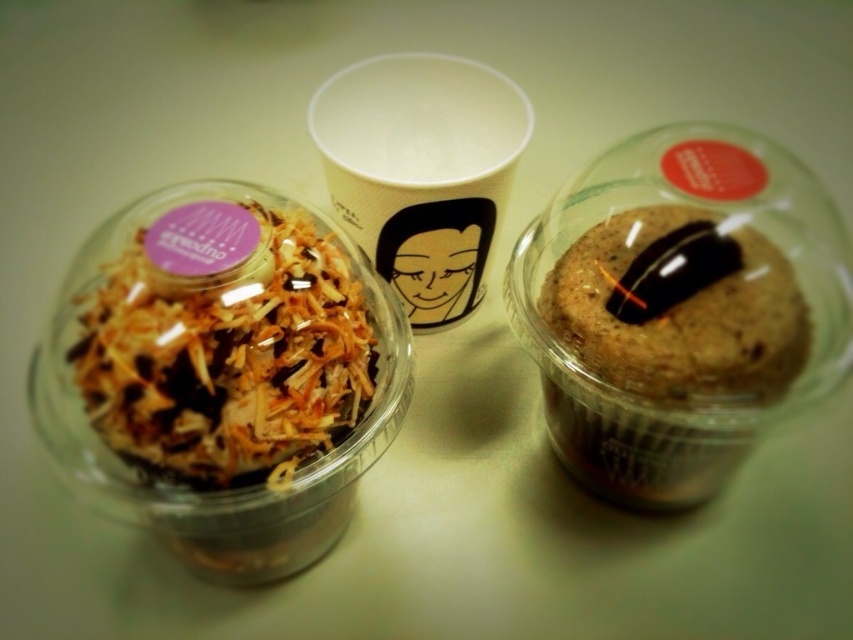
Question: Observing the image, what is the correct spatial positioning of brown matte muffin at right in reference to white paper cup at center?

Choices:
 (A) below
 (B) above

Answer: (A)

Question: Which object is farther from the camera taking this photo?

Choices:
 (A) translucent plastic dessert at left
 (B) brown matte muffin at right
 (C) white paper cup at center

Answer: (C)

Question: Which of the following is the farthest from the observer?

Choices:
 (A) white paper cup at center
 (B) translucent plastic dessert at left
 (C) brown matte muffin at right

Answer: (A)

Question: Among these points, which one is farthest from the camera?

Choices:
 (A) (521, 108)
 (B) (113, 262)
 (C) (599, 346)

Answer: (A)

Question: Is translucent plastic dessert at left closer to camera compared to brown matte muffin at right?

Choices:
 (A) yes
 (B) no

Answer: (A)

Question: Is translucent plastic dessert at left thinner than brown matte muffin at right?

Choices:
 (A) no
 (B) yes

Answer: (A)